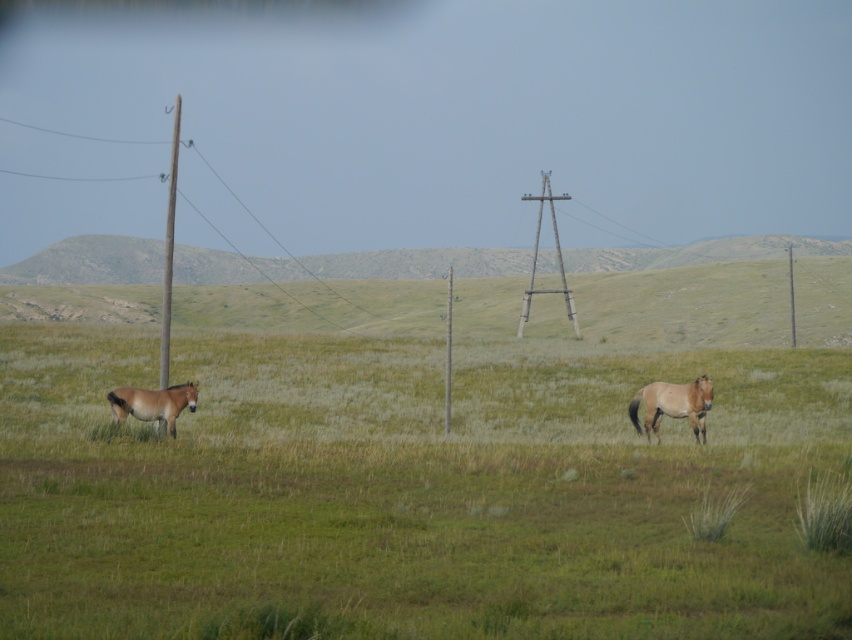
Between brown wooden telegraph pole at left and metallic gray telegraph pole at center, which one is positioned lower?

metallic gray telegraph pole at center

Does brown wooden telegraph pole at left have a greater height compared to metallic gray telegraph pole at center?

Yes, brown wooden telegraph pole at left is taller than metallic gray telegraph pole at center.

Is point (162, 291) positioned in front of point (574, 321)?

That is True.

Image resolution: width=852 pixels, height=640 pixels. I want to click on brown wooden telegraph pole at left, so click(x=170, y=250).

Which is below, brown wooden telegraph pole at left or smooth wood telegraph pole at center?

Positioned lower is smooth wood telegraph pole at center.

Who is positioned more to the right, brown wooden telegraph pole at left or smooth wood telegraph pole at center?

From the viewer's perspective, smooth wood telegraph pole at center appears more on the right side.

Between point (168, 211) and point (452, 285), which one is positioned in front?

Point (452, 285)

Locate an element on the screen. The image size is (852, 640). brown wooden telegraph pole at left is located at coordinates (170, 250).

Is point (649, 426) closer to camera compared to point (793, 308)?

That is True.

Is brown matte horse at right positioned in front of smooth wood telegraph pole at right?

Yes, it is.

Between point (692, 406) and point (789, 300), which one is positioned in front?

Point (692, 406)

I want to click on brown matte horse at right, so click(x=672, y=404).